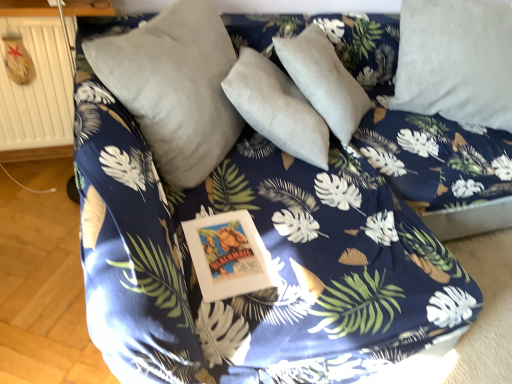
Question: From a real-world perspective, is satin gray pillow at center, which is the 1th pillow from left to right, positioned above or below beige wooden radiator at left?

Choices:
 (A) below
 (B) above

Answer: (B)

Question: From the image's perspective, is satin gray pillow at center, the 2th pillow from the right, located above or below beige wooden radiator at left?

Choices:
 (A) below
 (B) above

Answer: (A)

Question: Considering the real-world distances, which object is farthest from the satin gray pillow at center, the 2th pillow from the right?

Choices:
 (A) white soft pillow at upper right, which is the second pillow from left to right
 (B) beige wooden radiator at left

Answer: (A)

Question: Which object is the farthest from the white soft pillow at upper right, positioned as the first pillow in right-to-left order?

Choices:
 (A) beige wooden radiator at left
 (B) satin gray pillow at center, which is the 1th pillow from left to right

Answer: (A)